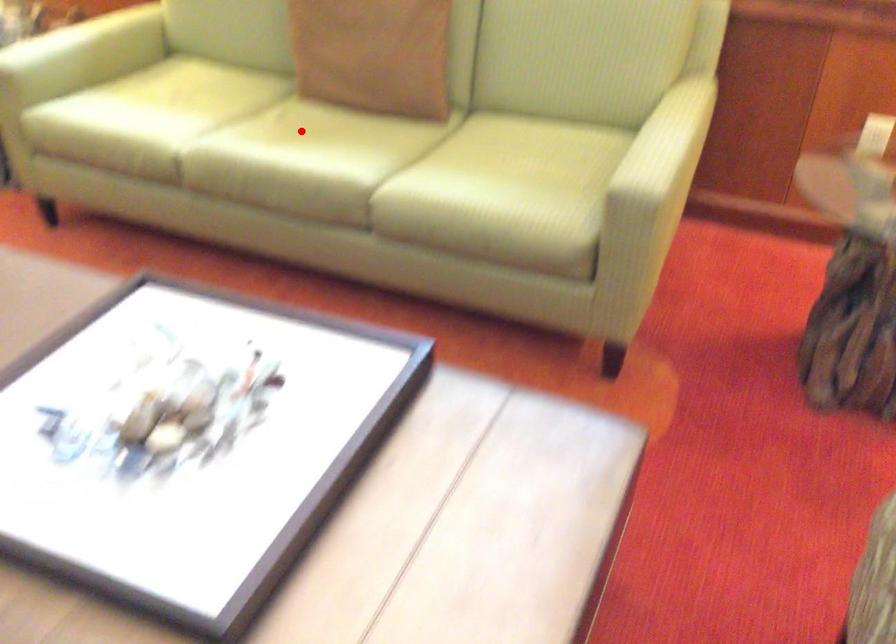
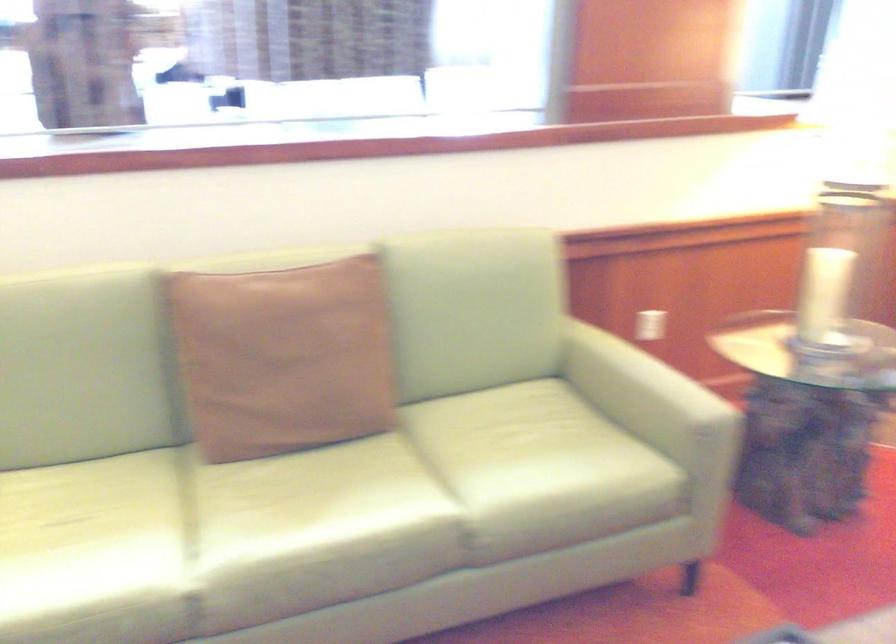
Question: I am providing you with two images of the same scene from different viewpoints. A red point is shown in image1. For the corresponding object point in image2, is it positioned nearer or farther from the camera?

Choices:
 (A) Nearer
 (B) Farther

Answer: (A)